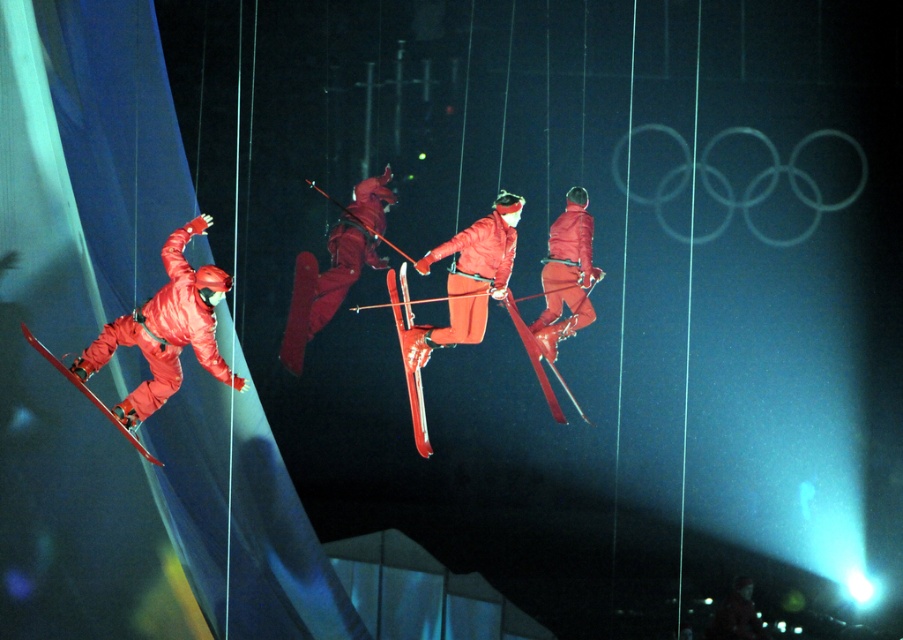
Locate an element on the screen. Image resolution: width=903 pixels, height=640 pixels. matte red ski suit at left is located at coordinates (166, 330).

Can you confirm if matte red ski suit at left is positioned below metallic red skis at center?

Incorrect, matte red ski suit at left is not positioned below metallic red skis at center.

Is point (187, 296) positioned behind point (427, 436)?

No.

Image resolution: width=903 pixels, height=640 pixels. I want to click on matte red ski suit at left, so click(x=166, y=330).

Does matte red snowsuit at center have a greater height compared to matte red ski suit at center?

Yes.

Does matte red snowsuit at center have a lesser height compared to matte red ski suit at center?

No.

I want to click on matte red snowsuit at center, so click(334, 266).

Between matte red ski suit at left and matte red ski at lower left, which one is positioned lower?

matte red ski at lower left is lower down.

Between point (228, 376) and point (155, 464), which one is positioned behind?

The point (228, 376) is more distant.

Where is `matte red ski suit at left`? matte red ski suit at left is located at coordinates (166, 330).